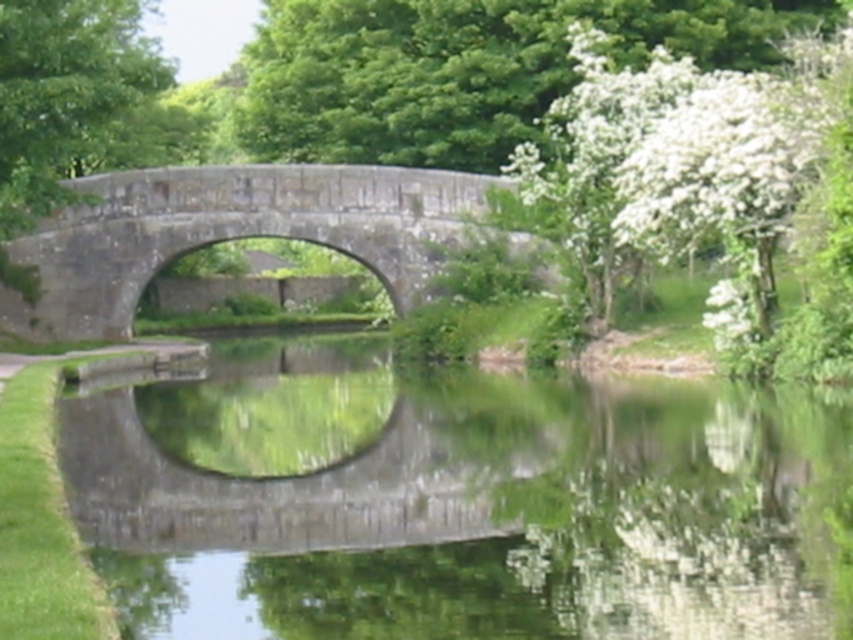
Is point (434, 148) positioned before point (380, 250)?

No, (434, 148) is behind (380, 250).

Is point (300, 8) closer to viewer compared to point (430, 259)?

No.

Where is `green leafy tree at upper center`? The width and height of the screenshot is (853, 640). green leafy tree at upper center is located at coordinates pyautogui.click(x=463, y=68).

Does green reflective water at center lie in front of green leafy tree at upper center?

Yes.

Who is more forward, (483, 588) or (469, 140)?

Point (483, 588)

Between point (225, 348) and point (289, 96), which one is positioned behind?

Point (289, 96)

Locate an element on the screen. green reflective water at center is located at coordinates pos(466,506).

Does point (207, 508) come farther from viewer compared to point (44, 298)?

No, it is not.

Consider the image. Can you confirm if green reflective water at center is shorter than stone bridge at center?

Yes.

Where is `green reflective water at center`? The width and height of the screenshot is (853, 640). green reflective water at center is located at coordinates (466, 506).